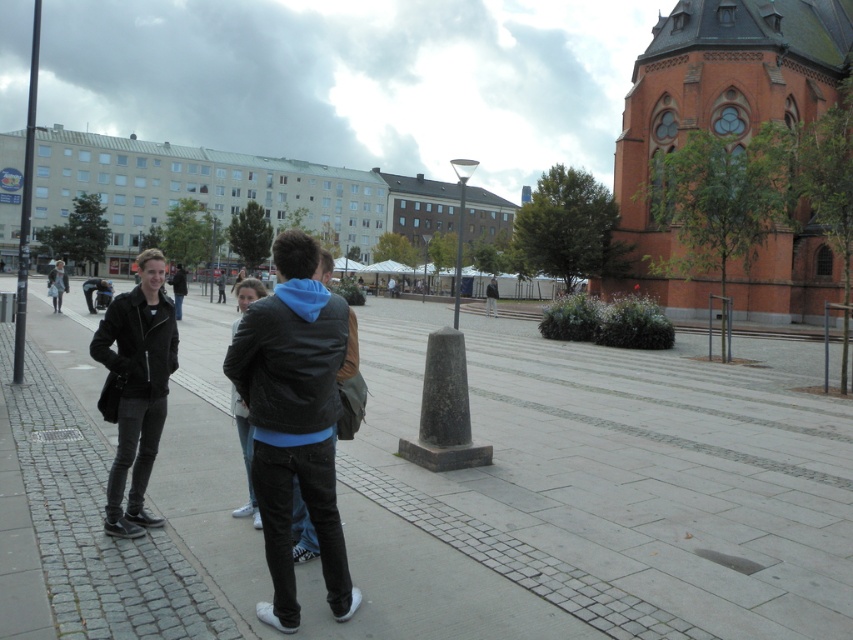
Question: Can you confirm if black leather jacket at left is thinner than matte black jacket at center?

Choices:
 (A) yes
 (B) no

Answer: (A)

Question: Among these points, which one is nearest to the camera?

Choices:
 (A) (178, 273)
 (B) (157, 397)
 (C) (345, 605)

Answer: (C)

Question: Does matte black jacket at center have a lesser width compared to dark gray leather jacket at left?

Choices:
 (A) yes
 (B) no

Answer: (A)

Question: In this image, where is matte black jacket at left located relative to matte black jacket at center?

Choices:
 (A) above
 (B) below

Answer: (B)

Question: Which point is farther to the camera?

Choices:
 (A) (258, 292)
 (B) (109, 344)

Answer: (A)

Question: Which of the following is the farthest from the observer?

Choices:
 (A) dark gray leather jacket at center
 (B) black leather jacket at left
 (C) dark gray leather jacket at left

Answer: (A)